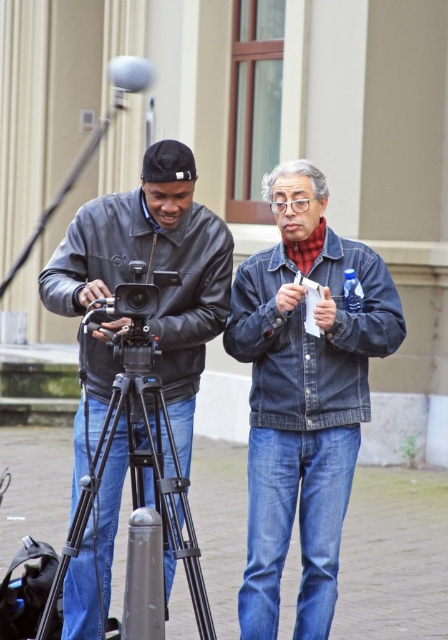
Question: Can you confirm if denim jacket at center is positioned below black leather jacket at left?

Choices:
 (A) no
 (B) yes

Answer: (A)

Question: Which point is closer to the camera?

Choices:
 (A) (225, 273)
 (B) (313, 451)

Answer: (B)

Question: Is denim jacket at center wider than black leather jacket at left?

Choices:
 (A) no
 (B) yes

Answer: (B)

Question: Does denim jacket at center have a smaller size compared to black leather jacket at left?

Choices:
 (A) yes
 (B) no

Answer: (B)